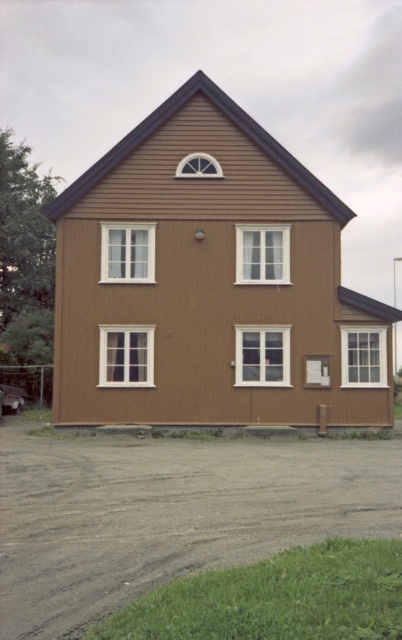
Is brown wood house at center bigger than dirt/gravel driveway at lower center?

Correct, brown wood house at center is larger in size than dirt/gravel driveway at lower center.

Measure the distance between brown wood house at center and camera.

They are 25.15 meters apart.

This screenshot has width=402, height=640. Identify the location of brown wood house at center. 211,284.